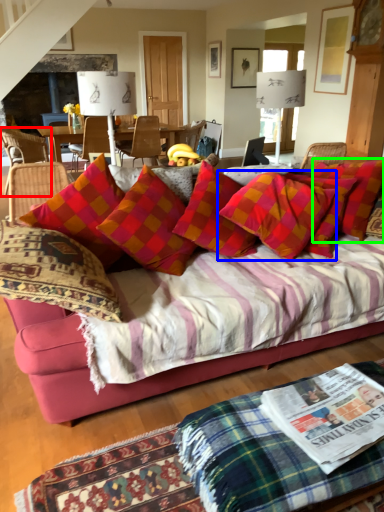
Question: Which is farther away from chair (highlighted by a red box)? pillow (highlighted by a blue box) or pillow (highlighted by a green box)?

Choices:
 (A) pillow
 (B) pillow

Answer: (B)